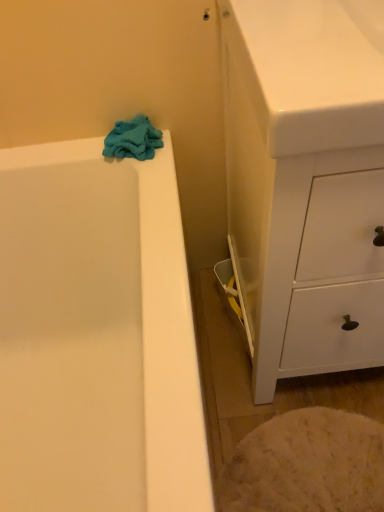
Question: Is point (124, 124) closer or farther from the camera than point (301, 306)?

Choices:
 (A) farther
 (B) closer

Answer: (A)

Question: In the image, is teal soft towel at upper left on the left side or the right side of white matte cabinet at right?

Choices:
 (A) left
 (B) right

Answer: (A)

Question: Looking at the image, does teal soft towel at upper left seem bigger or smaller compared to white matte cabinet at right?

Choices:
 (A) big
 (B) small

Answer: (B)

Question: From a real-world perspective, is white matte cabinet at right physically located above or below teal soft towel at upper left?

Choices:
 (A) above
 (B) below

Answer: (B)

Question: Is point (276, 318) closer or farther from the camera than point (157, 132)?

Choices:
 (A) closer
 (B) farther

Answer: (A)

Question: Is white matte cabinet at right taller or shorter than teal soft towel at upper left?

Choices:
 (A) tall
 (B) short

Answer: (A)

Question: Is white matte cabinet at right inside the boundaries of teal soft towel at upper left, or outside?

Choices:
 (A) inside
 (B) outside

Answer: (B)